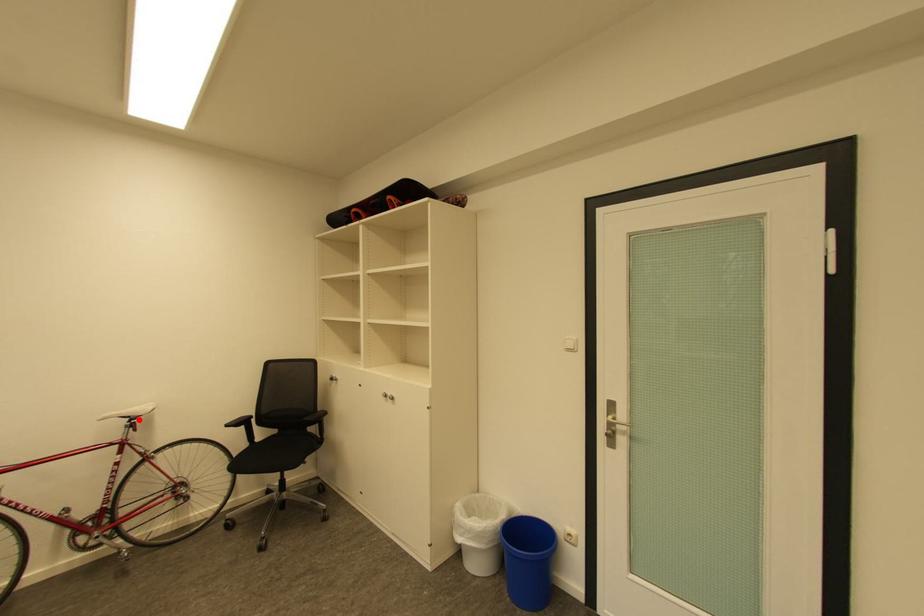
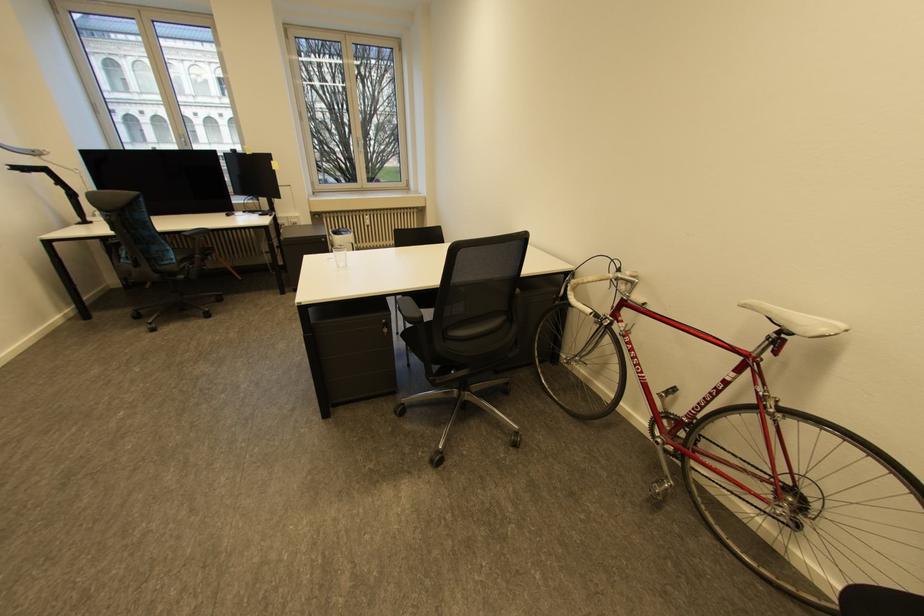
Locate, in the second image, the point that corresponds to the highlighted location in the first image.

(789, 331)